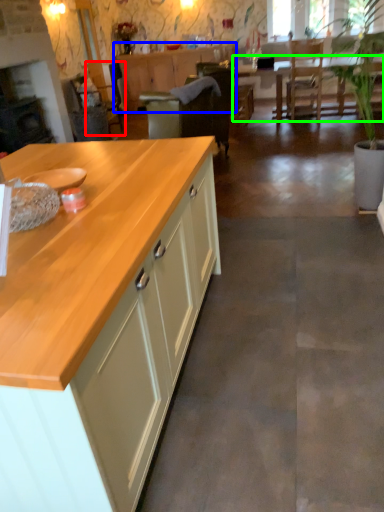
Question: Which object is the closest to the armchair (highlighted by a red box)? Choose among these: cabinetry (highlighted by a blue box) or table (highlighted by a green box).

Choices:
 (A) cabinetry
 (B) table

Answer: (A)